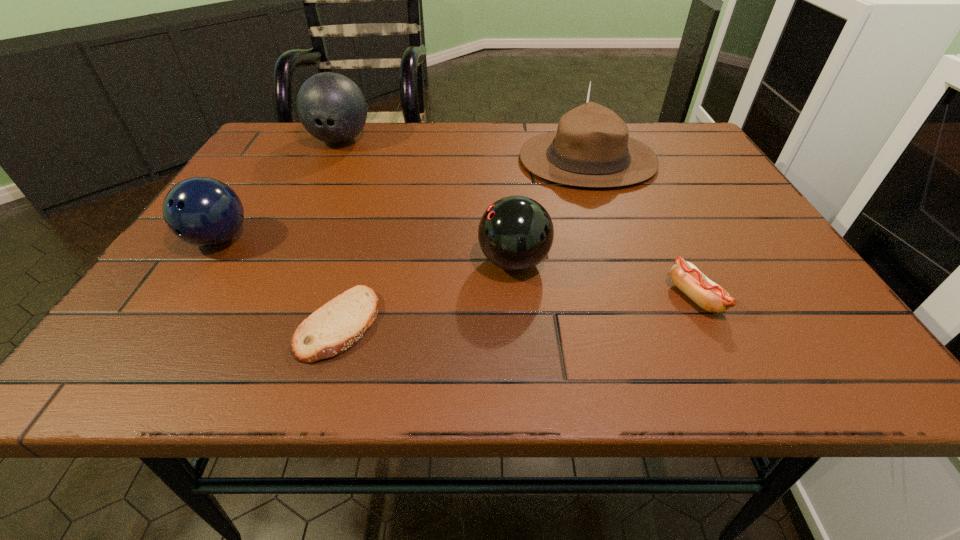
This screenshot has height=540, width=960. In the image, there is a desktop. In order to click on vacant space at the far edge in this screenshot , I will do `click(520, 125)`.

The width and height of the screenshot is (960, 540). In the image, there is a desktop. Identify the location of free region at the left edge. (245, 204).

This screenshot has height=540, width=960. In order to click on free space at the right edge of the desktop in this screenshot , I will do `click(707, 245)`.

In the image, there is a desktop. Where is `vacant region at the far left corner`? The image size is (960, 540). vacant region at the far left corner is located at coordinates (276, 144).

Locate an element on the screen. Image resolution: width=960 pixels, height=540 pixels. free space at the near left corner of the desktop is located at coordinates (137, 360).

Find the location of `free space between the fedora and the pita bread`. free space between the fedora and the pita bread is located at coordinates (463, 242).

Image resolution: width=960 pixels, height=540 pixels. Find the location of `empty space that is in between the sausage and the shortest object`. empty space that is in between the sausage and the shortest object is located at coordinates point(516,311).

You are a GUI agent. You are given a task and a screenshot of the screen. Output one action in this format:
    pyautogui.click(x=<x>, y=<y>)
    Task: Click on the free space between the tallest bowling ball and the shortest object
    The image size is (960, 540).
    Given the screenshot: What is the action you would take?
    pyautogui.click(x=339, y=232)

What are the coordinates of `free area in between the tallest bowling ball and the rightmost bowling ball` in the screenshot? It's located at (427, 201).

Locate an element on the screen. The height and width of the screenshot is (540, 960). vacant point located between the sausage and the rightmost bowling ball is located at coordinates (605, 280).